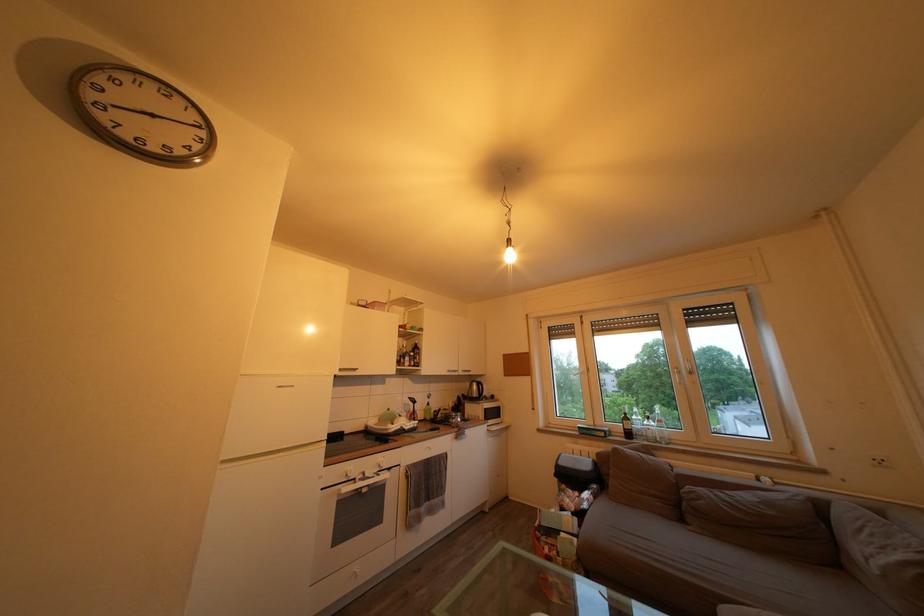
Where is `white oven knob`? The height and width of the screenshot is (616, 924). white oven knob is located at coordinates (349, 472).